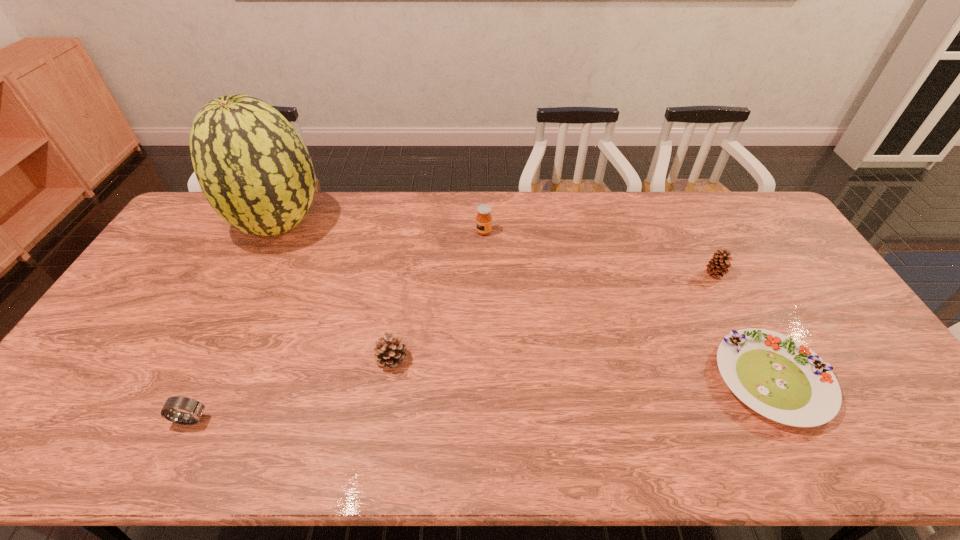
Where is `vacant area that satisfies the following two spatial constraints: 1. on the front-facing side of the fourth object from left to right; 2. on the back side of the salad plate`? vacant area that satisfies the following two spatial constraints: 1. on the front-facing side of the fourth object from left to right; 2. on the back side of the salad plate is located at coordinates (486, 380).

This screenshot has width=960, height=540. I want to click on free point that satisfies the following two spatial constraints: 1. on the front side of the watermelon; 2. on the right side of the shortest object, so click(x=203, y=380).

You are a GUI agent. You are given a task and a screenshot of the screen. Output one action in this format:
    pyautogui.click(x=<x>, y=<y>)
    Task: Click on the vacant space that satisfies the following two spatial constraints: 1. on the front side of the nearer pinecone; 2. on the face of the second shortest object
    This screenshot has width=960, height=540.
    Given the screenshot: What is the action you would take?
    pyautogui.click(x=382, y=419)

This screenshot has width=960, height=540. Find the location of `free spot that satisfies the following two spatial constraints: 1. on the front side of the farther pinecone; 2. on the right side of the shortest object`. free spot that satisfies the following two spatial constraints: 1. on the front side of the farther pinecone; 2. on the right side of the shortest object is located at coordinates (770, 380).

The image size is (960, 540). What are the coordinates of `free space in the image that satisfies the following two spatial constraints: 1. on the back side of the salad plate; 2. on the front-facing side of the honey` in the screenshot? It's located at (695, 232).

Locate an element on the screen. The image size is (960, 540). free space that satisfies the following two spatial constraints: 1. on the front-facing side of the salad plate; 2. on the right side of the honey is located at coordinates (486, 380).